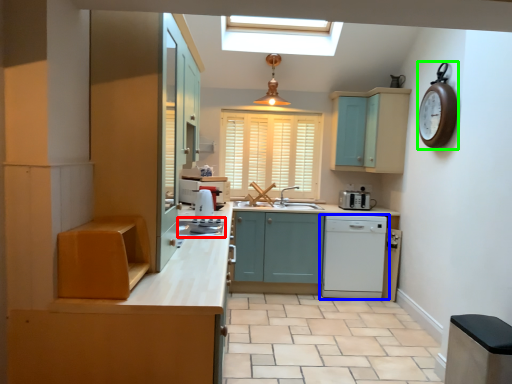
Question: Estimate the real-world distances between objects in this image. Which object is farther from appliance (highlighted by a red box), home appliance (highlighted by a blue box) or clock (highlighted by a green box)?

Choices:
 (A) home appliance
 (B) clock

Answer: (B)